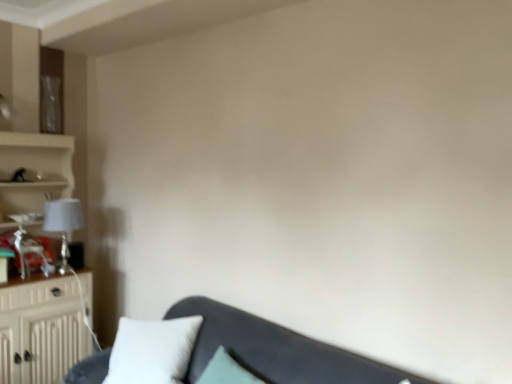
Question: Is beige wood cabinet at left completely or partially outside of matte white lampshade at left?

Choices:
 (A) no
 (B) yes

Answer: (B)

Question: From a real-world perspective, is beige wood cabinet at left positioned over matte white lampshade at left based on gravity?

Choices:
 (A) yes
 (B) no

Answer: (B)

Question: Considering the relative sizes of beige wood cabinet at left and matte white lampshade at left in the image provided, is beige wood cabinet at left thinner than matte white lampshade at left?

Choices:
 (A) yes
 (B) no

Answer: (B)

Question: Is beige wood cabinet at left behind matte white lampshade at left?

Choices:
 (A) no
 (B) yes

Answer: (A)

Question: Does beige wood cabinet at left appear on the left side of matte white lampshade at left?

Choices:
 (A) no
 (B) yes

Answer: (B)

Question: Is beige wood cabinet at left directly adjacent to matte white lampshade at left?

Choices:
 (A) yes
 (B) no

Answer: (B)

Question: Can you see beige wood cabinet at left touching white soft pillow at lower left?

Choices:
 (A) yes
 (B) no

Answer: (B)

Question: Considering the relative sizes of beige wood cabinet at left and white soft pillow at lower left in the image provided, is beige wood cabinet at left thinner than white soft pillow at lower left?

Choices:
 (A) yes
 (B) no

Answer: (A)

Question: Is beige wood cabinet at left not near white soft pillow at lower left?

Choices:
 (A) yes
 (B) no

Answer: (A)

Question: Can you confirm if beige wood cabinet at left is wider than white soft pillow at lower left?

Choices:
 (A) no
 (B) yes

Answer: (A)

Question: From a real-world perspective, does beige wood cabinet at left sit lower than white soft pillow at lower left?

Choices:
 (A) no
 (B) yes

Answer: (A)

Question: Does beige wood cabinet at left appear on the left side of white soft pillow at lower left?

Choices:
 (A) yes
 (B) no

Answer: (A)

Question: From a real-world perspective, is matte white lampshade at left physically below velvet dark gray couch at lower center?

Choices:
 (A) yes
 (B) no

Answer: (B)